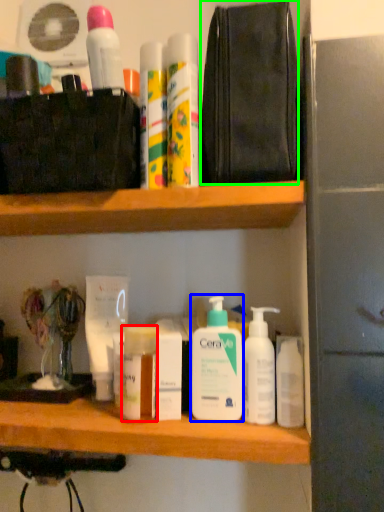
Question: Which is nearer to the toiletry (highlighted by a red box)? cleaning product (highlighted by a blue box) or pouch (highlighted by a green box).

Choices:
 (A) cleaning product
 (B) pouch

Answer: (A)